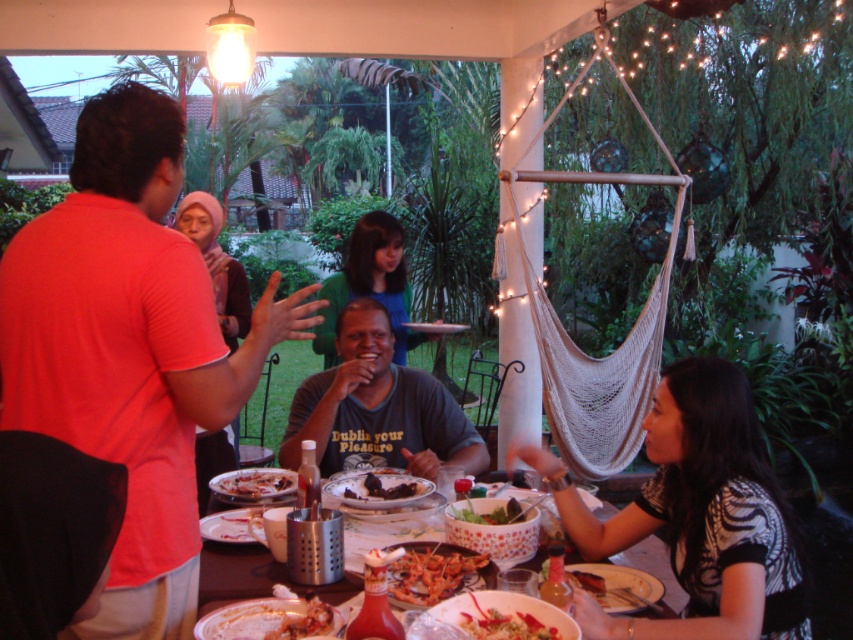
Question: Does black and white printed shirt at lower right have a larger size compared to smooth plastic bowl at center?

Choices:
 (A) yes
 (B) no

Answer: (A)

Question: Which object is the closest to the shiny plastic fork at lower center?

Choices:
 (A) dark gray t-shirt at center
 (B) smooth plastic bowl at center
 (C) shiny red lobster at center
 (D) plastic bottle at center

Answer: (C)

Question: Which point is farther to the camera?

Choices:
 (A) (218, 205)
 (B) (422, 381)
 (C) (676, 426)
 (D) (496, 634)

Answer: (A)

Question: Is plastic bottle at center thinner than shiny silver plate at center?

Choices:
 (A) no
 (B) yes

Answer: (A)

Question: Based on their relative distances, which object is nearer to the smooth plastic bowl at center?

Choices:
 (A) shiny plastic fork at lower center
 (B) plastic bottle at center

Answer: (B)

Question: Is dark gray t-shirt at center wider than shiny plastic fork at lower center?

Choices:
 (A) yes
 (B) no

Answer: (A)